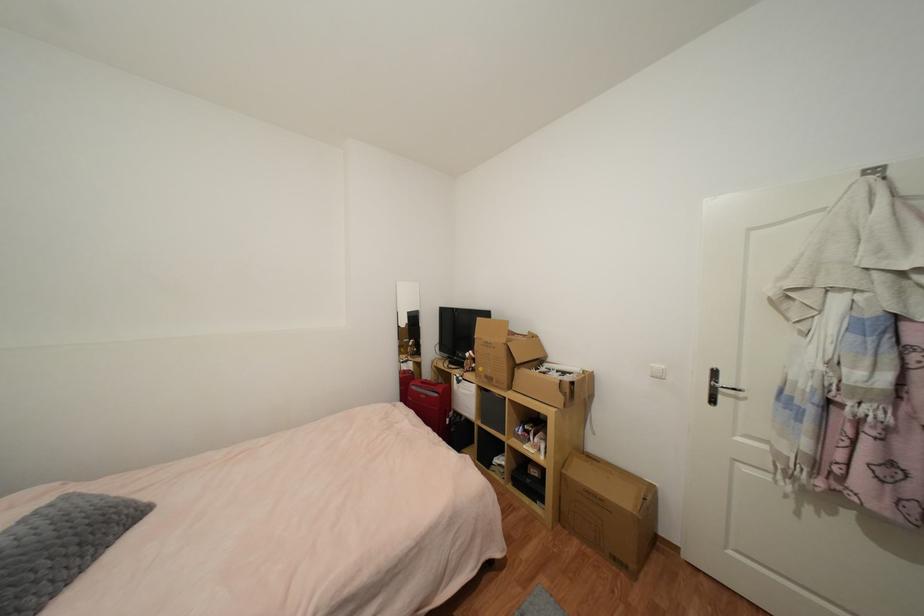
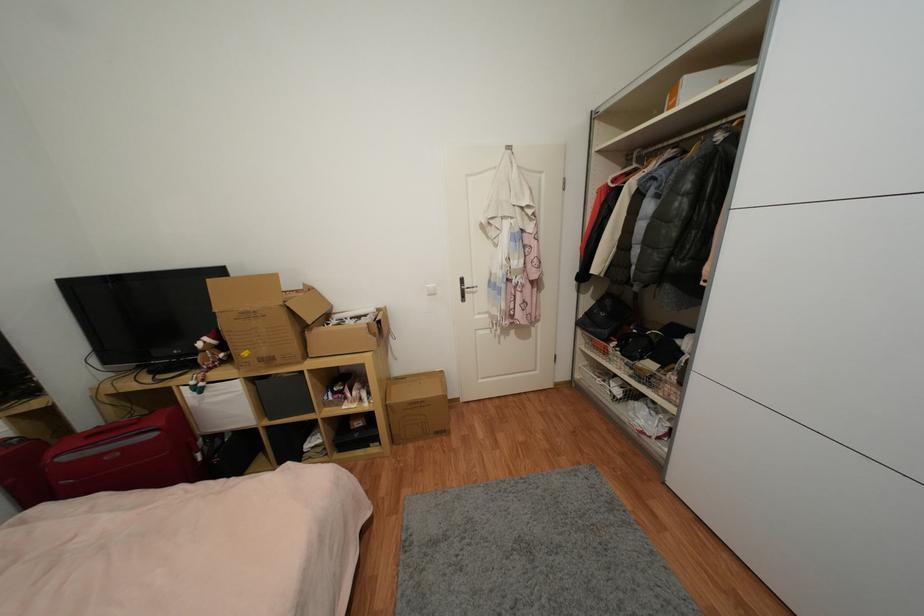
In the second image, find the point that corresponds to (728,383) in the first image.

(471, 286)